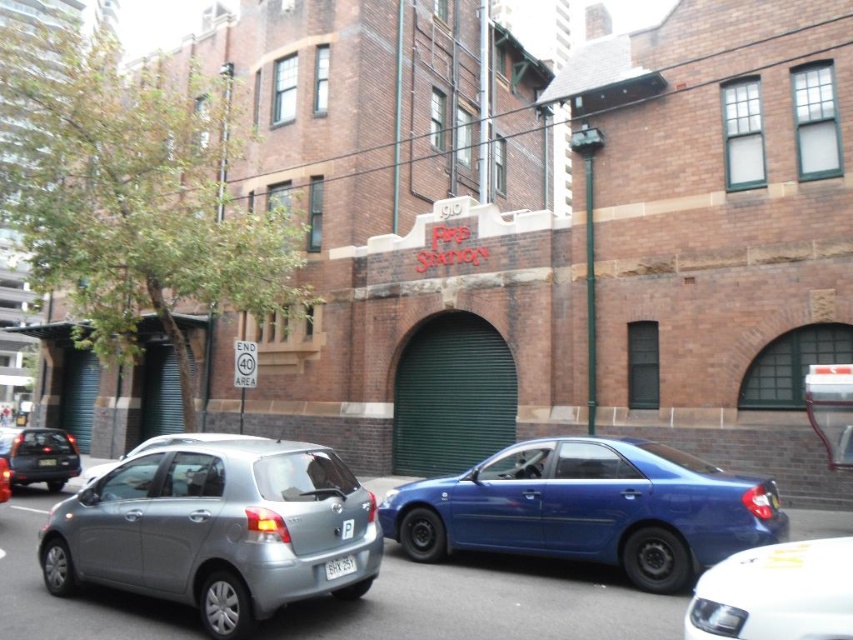
Based on the photo, who is more forward, (270,602) or (128,456)?

Point (270,602)

Is satin silver hatchback at lower left to the left of satin silver sedan at center from the viewer's perspective?

Incorrect, satin silver hatchback at lower left is not on the left side of satin silver sedan at center.

Find the location of a particular element. The width and height of the screenshot is (853, 640). satin silver hatchback at lower left is located at coordinates (218, 529).

The width and height of the screenshot is (853, 640). I want to click on satin silver hatchback at lower left, so click(x=218, y=529).

Is satin silver hatchback at lower left to the right of matte black sedan at left from the viewer's perspective?

Yes, satin silver hatchback at lower left is to the right of matte black sedan at left.

Between satin silver hatchback at lower left and matte black sedan at left, which one is positioned higher?

satin silver hatchback at lower left is above.

Is point (78, 516) less distant than point (38, 451)?

Yes, point (78, 516) is in front of point (38, 451).

This screenshot has width=853, height=640. Identify the location of satin silver hatchback at lower left. (218, 529).

Is point (148, 445) farther from camera compared to point (341, 570)?

Yes, point (148, 445) is behind point (341, 570).

Measure the distance between satin silver sedan at center and camera.

satin silver sedan at center is 21.01 feet away from camera.

The width and height of the screenshot is (853, 640). Identify the location of satin silver sedan at center. (160, 445).